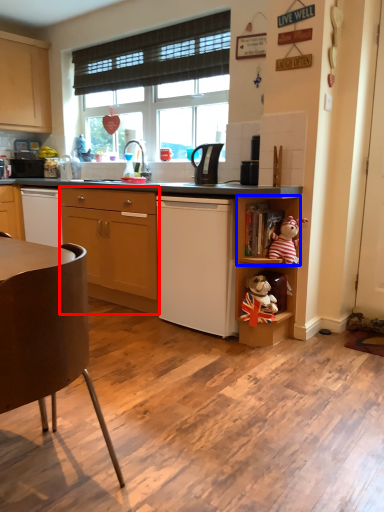
Question: Which point is further to the camera, cabinetry (highlighted by a red box) or shelf (highlighted by a blue box)?

Choices:
 (A) cabinetry
 (B) shelf

Answer: (A)